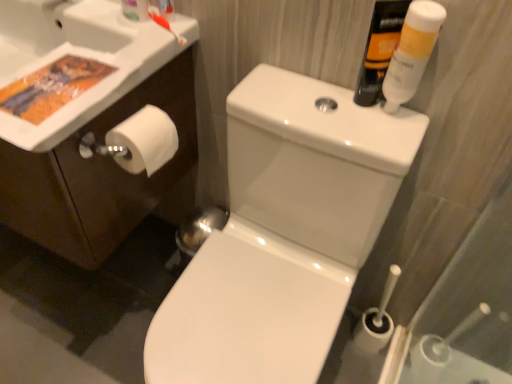
The width and height of the screenshot is (512, 384). What do you see at coordinates (135, 10) in the screenshot?
I see `translucent plastic toothbrush at upper left` at bounding box center [135, 10].

The height and width of the screenshot is (384, 512). Describe the element at coordinates (82, 55) in the screenshot. I see `white glossy sink at upper left` at that location.

What do you see at coordinates (379, 49) in the screenshot? The height and width of the screenshot is (384, 512). I see `translucent plastic mouthwash at upper right, the first mouthwash viewed from the left` at bounding box center [379, 49].

The height and width of the screenshot is (384, 512). I want to click on translucent plastic toothbrush at upper left, so click(135, 10).

Between white glossy sink at upper left and translucent plastic toothbrush at upper left, which one is positioned in front?

white glossy sink at upper left.

What's the angular difference between white glossy sink at upper left and translucent plastic toothbrush at upper left's facing directions?

1.43 degrees.

Which object is positioned more to the right, white glossy sink at upper left or translucent plastic toothbrush at upper left?

translucent plastic toothbrush at upper left is more to the right.

Considering the sizes of objects white glossy sink at upper left and translucent plastic toothbrush at upper left in the image provided, who is smaller, white glossy sink at upper left or translucent plastic toothbrush at upper left?

Smaller between the two is translucent plastic toothbrush at upper left.

From a real-world perspective, between orange plastic toothbrush at upper left and white matte toilet paper at left, who is vertically lower?

white matte toilet paper at left.

Considering the sizes of objects orange plastic toothbrush at upper left and white matte toilet paper at left in the image provided, who is thinner, orange plastic toothbrush at upper left or white matte toilet paper at left?

orange plastic toothbrush at upper left.

In terms of height, does orange plastic toothbrush at upper left look taller or shorter compared to white matte toilet paper at left?

orange plastic toothbrush at upper left is shorter than white matte toilet paper at left.

Based on the photo, considering the positions of objects orange plastic toothbrush at upper left and white matte toilet paper at left in the image provided, who is more to the right, orange plastic toothbrush at upper left or white matte toilet paper at left?

orange plastic toothbrush at upper left.

From a real-world perspective, is white matte toilet paper at left positioned over white glossy tube at upper right, acting as the first mouthwash starting from the right, based on gravity?

No.

How different are the orientations of white matte toilet paper at left and white glossy tube at upper right, acting as the first mouthwash starting from the right, in degrees?

There is a 89-degree angle between the facing directions of white matte toilet paper at left and white glossy tube at upper right, acting as the first mouthwash starting from the right.

Is white matte toilet paper at left far away from white glossy tube at upper right, acting as the first mouthwash starting from the right?

Actually, white matte toilet paper at left and white glossy tube at upper right, acting as the first mouthwash starting from the right, are a little close together.

Identify the location of the 2nd mouthwash located above the white matte toilet paper at left (from a real-world perspective). point(412,52).

Measure the distance between translucent plastic mouthwash at upper right, the first mouthwash viewed from the left, and white matte toilet paper at left.

translucent plastic mouthwash at upper right, the first mouthwash viewed from the left, and white matte toilet paper at left are 17.74 inches apart from each other.

Considering the relative sizes of translucent plastic mouthwash at upper right, the first mouthwash viewed from the left, and white matte toilet paper at left in the image provided, is translucent plastic mouthwash at upper right, the first mouthwash viewed from the left, taller than white matte toilet paper at left?

Indeed, translucent plastic mouthwash at upper right, the first mouthwash viewed from the left, has a greater height compared to white matte toilet paper at left.

Is translucent plastic mouthwash at upper right, the second mouthwash when ordered from right to left, bigger than white matte toilet paper at left?

Result: Actually, translucent plastic mouthwash at upper right, the second mouthwash when ordered from right to left, might be smaller than white matte toilet paper at left.

Is translucent plastic mouthwash at upper right, the second mouthwash when ordered from right to left, directly adjacent to white matte toilet paper at left?

translucent plastic mouthwash at upper right, the second mouthwash when ordered from right to left, is not next to white matte toilet paper at left, and they're not touching.

Is point (245, 156) closer to camera compared to point (123, 52)?

No.

Is white glossy toilet at center at the right side of white glossy sink at upper left?

Yes, white glossy toilet at center is to the right of white glossy sink at upper left.

Is white glossy toilet at center shorter than white glossy sink at upper left?

No, white glossy toilet at center is not shorter than white glossy sink at upper left.

In order to click on toilet lying in front of the white glossy sink at upper left in this screenshot , I will do `click(283, 233)`.

In terms of width, does translucent plastic mouthwash at upper right, the second mouthwash when ordered from right to left, look wider or thinner when compared to white glossy toilet at center?

In the image, translucent plastic mouthwash at upper right, the second mouthwash when ordered from right to left, appears to be more narrow than white glossy toilet at center.

Does translucent plastic mouthwash at upper right, the first mouthwash viewed from the left, turn towards white glossy toilet at center?

No, translucent plastic mouthwash at upper right, the first mouthwash viewed from the left, is not facing towards white glossy toilet at center.

Which of these two, translucent plastic mouthwash at upper right, the second mouthwash when ordered from right to left, or white glossy toilet at center, stands taller?

With more height is white glossy toilet at center.

Which is behind, point (384, 5) or point (238, 262)?

The point (238, 262) is more distant.

Considering the relative positions of white glossy tube at upper right, which appears as the second mouthwash when viewed from the left, and white glossy sink at upper left in the image provided, is white glossy tube at upper right, which appears as the second mouthwash when viewed from the left, in front of white glossy sink at upper left?

No, white glossy tube at upper right, which appears as the second mouthwash when viewed from the left, is further to the viewer.

Considering the sizes of objects white glossy tube at upper right, acting as the first mouthwash starting from the right, and white glossy sink at upper left in the image provided, who is bigger, white glossy tube at upper right, acting as the first mouthwash starting from the right, or white glossy sink at upper left?

With larger size is white glossy sink at upper left.

Is white glossy tube at upper right, which appears as the second mouthwash when viewed from the left, positioned far away from white glossy sink at upper left?

No.

From the image's perspective, is white glossy tube at upper right, which appears as the second mouthwash when viewed from the left, above or below white glossy sink at upper left?

Based on their image positions, white glossy tube at upper right, which appears as the second mouthwash when viewed from the left, is located beneath white glossy sink at upper left.

You are a GUI agent. You are given a task and a screenshot of the screen. Output one action in this format:
    pyautogui.click(x=<x>, y=<y>)
    Task: Click on the sink below the translucent plastic toothbrush at upper left (from the image's perspective)
    
    Given the screenshot: What is the action you would take?
    pyautogui.click(x=82, y=55)

The height and width of the screenshot is (384, 512). What are the coordinates of `toilet brush that is above the white matte toilet paper at left (from a real-world perspective)` in the screenshot? It's located at (166, 26).

When comparing their distances from white matte toilet paper at left, does white glossy tube at upper right, which appears as the second mouthwash when viewed from the left, or orange plastic toothbrush at upper left seem closer?

Among the two, orange plastic toothbrush at upper left is located nearer to white matte toilet paper at left.

Based on the photo, estimate the real-world distances between objects in this image. Which object is closer to translucent plastic mouthwash at upper right, the first mouthwash viewed from the left, translucent plastic toothbrush at upper left or white glossy sink at upper left?

translucent plastic toothbrush at upper left is closer to translucent plastic mouthwash at upper right, the first mouthwash viewed from the left.

From the image, which object appears to be farther from white glossy sink at upper left, white matte toilet paper at left or translucent plastic mouthwash at upper right, the first mouthwash viewed from the left?

translucent plastic mouthwash at upper right, the first mouthwash viewed from the left, is positioned further to the anchor white glossy sink at upper left.

Looking at the image, which one is located further to white matte toilet paper at left, white glossy toilet at center or translucent plastic toothbrush at upper left?

white glossy toilet at center lies further to white matte toilet paper at left than the other object.

From the image, which object appears to be nearer to white matte toilet paper at left, translucent plastic toothbrush at upper left or white glossy sink at upper left?

The object closer to white matte toilet paper at left is white glossy sink at upper left.

Estimate the real-world distances between objects in this image. Which object is further from translucent plastic toothbrush at upper left, white glossy tube at upper right, acting as the first mouthwash starting from the right, or white glossy toilet at center?

white glossy toilet at center lies further to translucent plastic toothbrush at upper left than the other object.

Looking at the image, which one is located closer to translucent plastic mouthwash at upper right, the first mouthwash viewed from the left, white glossy tube at upper right, which appears as the second mouthwash when viewed from the left, or translucent plastic toothbrush at upper left?

white glossy tube at upper right, which appears as the second mouthwash when viewed from the left.

Considering their positions, is white glossy sink at upper left positioned further to orange plastic toothbrush at upper left than translucent plastic toothbrush at upper left?

white glossy sink at upper left is positioned further to the anchor orange plastic toothbrush at upper left.

The image size is (512, 384). I want to click on toilet brush between white matte toilet paper at left and translucent plastic mouthwash at upper right, the first mouthwash viewed from the left, from left to right, so click(166, 26).

Locate an element on the screen. toilet paper situated between translucent plastic toothbrush at upper left and translucent plastic mouthwash at upper right, the first mouthwash viewed from the left, from left to right is located at coordinates (143, 141).

You are a GUI agent. You are given a task and a screenshot of the screen. Output one action in this format:
    pyautogui.click(x=<x>, y=<y>)
    Task: Click on the toilet brush between translucent plastic toothbrush at upper left and white glossy toilet at center in the up-down direction
    
    Given the screenshot: What is the action you would take?
    pyautogui.click(x=166, y=26)

Image resolution: width=512 pixels, height=384 pixels. Identify the location of toilet paper between white glossy sink at upper left and white glossy toilet at center from top to bottom. (143, 141).